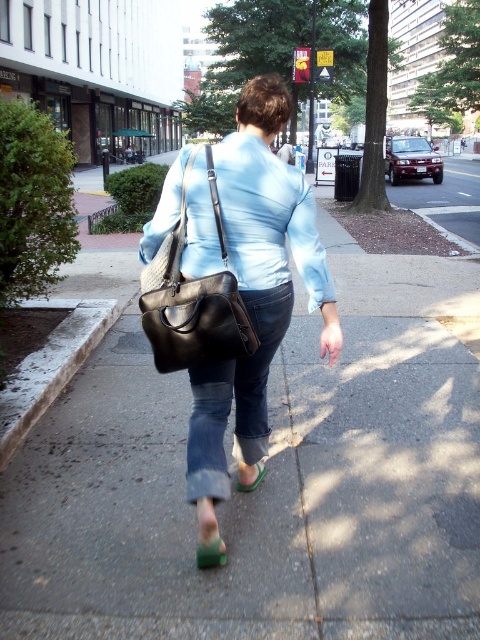
From the picture: You are standing at the camera position and see the matte black bag at center. If you want to walk directly towards the bag, which direction should you move relative to the woman walking away from the camera?

The matte black bag at center is located at point (231, 285), so you should move in the direction opposite to where the woman is walking to reach the bag.

You are a fashion stylist assisting a client who wants to choose between the green rubber sandal at lower center and the green suede sandal at lower center based on height. Which one is taller?

The green rubber sandal at lower center is taller than the green suede sandal at lower center.